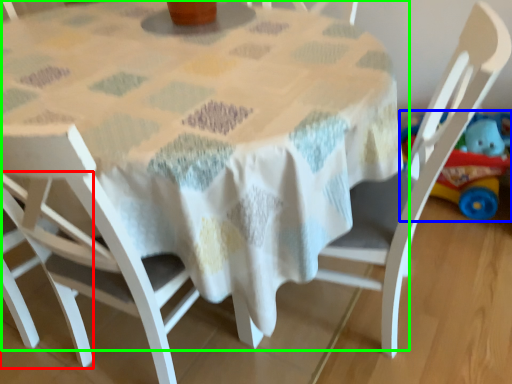
Question: Based on their relative distances, which object is farther from chair (highlighted by a red box)? Choose from toy (highlighted by a blue box) and table (highlighted by a green box).

Choices:
 (A) toy
 (B) table

Answer: (A)